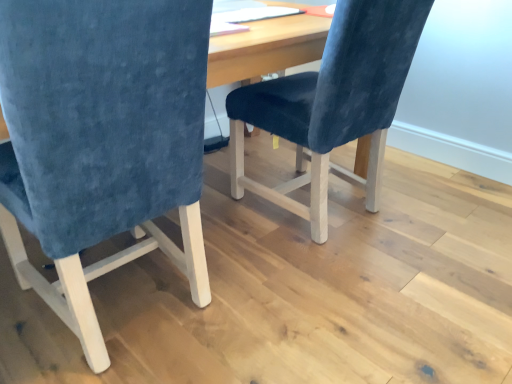
Question: Which direction should I rotate to look at velvet blue chair at center, which ranks as the first chair in right-to-left order?

Choices:
 (A) right
 (B) left

Answer: (A)

Question: Should I look upward or downward to see velvet blue chair at left, which appears as the 2th chair when viewed from the right?

Choices:
 (A) down
 (B) up

Answer: (B)

Question: Is velvet blue chair at left, which appears as the 2th chair when viewed from the right, touching velvet blue chair at center, which is the 2th chair from left to right?

Choices:
 (A) yes
 (B) no

Answer: (B)

Question: Is velvet blue chair at left, which is the 1th chair in left-to-right order, thinner than velvet blue chair at center, which is the 2th chair from left to right?

Choices:
 (A) yes
 (B) no

Answer: (A)

Question: Would you consider velvet blue chair at left, which is the 1th chair in left-to-right order, to be distant from velvet blue chair at center, which is the 2th chair from left to right?

Choices:
 (A) no
 (B) yes

Answer: (A)

Question: Is the position of velvet blue chair at left, which is the 1th chair in left-to-right order, less distant than that of velvet blue chair at center, which is the 2th chair from left to right?

Choices:
 (A) yes
 (B) no

Answer: (A)

Question: Can you confirm if velvet blue chair at left, which appears as the 2th chair when viewed from the right, is wider than velvet blue chair at center, which ranks as the first chair in right-to-left order?

Choices:
 (A) no
 (B) yes

Answer: (A)

Question: Can you confirm if velvet blue chair at left, which appears as the 2th chair when viewed from the right, is positioned to the left of velvet blue chair at center, which ranks as the first chair in right-to-left order?

Choices:
 (A) no
 (B) yes

Answer: (B)

Question: From the image's perspective, would you say velvet blue chair at center, which ranks as the first chair in right-to-left order, is shown under velvet blue chair at left, which is the 1th chair in left-to-right order?

Choices:
 (A) yes
 (B) no

Answer: (B)

Question: Is velvet blue chair at center, which ranks as the first chair in right-to-left order, wider than velvet blue chair at left, which appears as the 2th chair when viewed from the right?

Choices:
 (A) no
 (B) yes

Answer: (B)

Question: From the image's perspective, does velvet blue chair at center, which is the 2th chair from left to right, appear higher than velvet blue chair at left, which is the 1th chair in left-to-right order?

Choices:
 (A) yes
 (B) no

Answer: (A)

Question: Could you tell me if velvet blue chair at center, which ranks as the first chair in right-to-left order, is facing velvet blue chair at left, which is the 1th chair in left-to-right order?

Choices:
 (A) yes
 (B) no

Answer: (B)

Question: Considering the relative positions of velvet blue chair at center, which is the 2th chair from left to right, and velvet blue chair at left, which is the 1th chair in left-to-right order, in the image provided, is velvet blue chair at center, which is the 2th chair from left to right, to the right of velvet blue chair at left, which is the 1th chair in left-to-right order, from the viewer's perspective?

Choices:
 (A) yes
 (B) no

Answer: (A)

Question: Is velvet blue chair at center, which ranks as the first chair in right-to-left order, closer to the viewer compared to velvet blue chair at left, which is the 1th chair in left-to-right order?

Choices:
 (A) no
 (B) yes

Answer: (A)

Question: In terms of width, does velvet blue chair at left, which is the 1th chair in left-to-right order, look wider or thinner when compared to velvet blue chair at center, which ranks as the first chair in right-to-left order?

Choices:
 (A) wide
 (B) thin

Answer: (B)